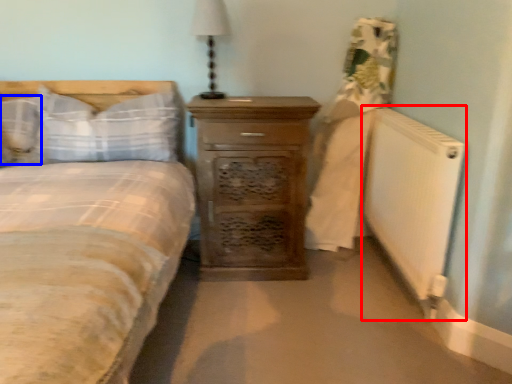
Question: Which object appears farthest to the camera in this image, radiator (highlighted by a red box) or pillow (highlighted by a blue box)?

Choices:
 (A) radiator
 (B) pillow

Answer: (B)